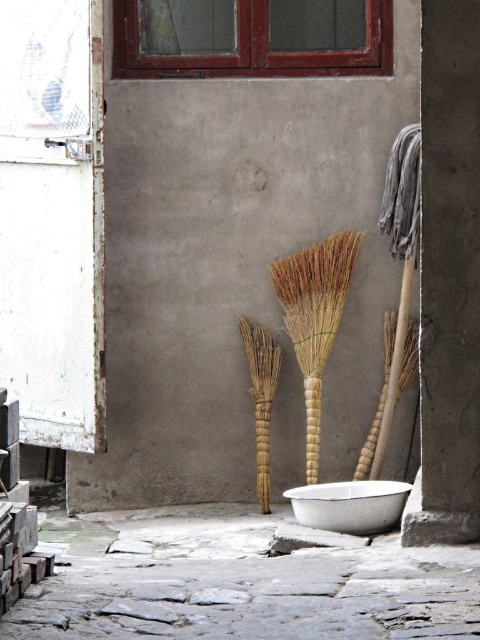
You are a painter setting up your easel in the courtyard. You need to place your canvas between the natural straw broom at center and the white enamel bowl at lower center. Based on their positions, where should you position your canvas?

Answer: Since the natural straw broom at center is above the white enamel bowl at lower center, you should place your canvas between them by positioning it below the natural straw broom at center and above the white enamel bowl at lower center to ensure it is between both objects.

Looking at this image, you are a painter standing in the courtyard with a 36 inch long ladder. You need to place your ladder between the natural straw broom at center and the white enamel bowl at lower center. Will the ladder fit between them without overlapping either object?

The distance between the natural straw broom at center and the white enamel bowl at lower center is 31.52 inches. Since the ladder is 36 inches long, it is longer than the space between them. Therefore, the ladder cannot fit between them without overlapping one of the objects.